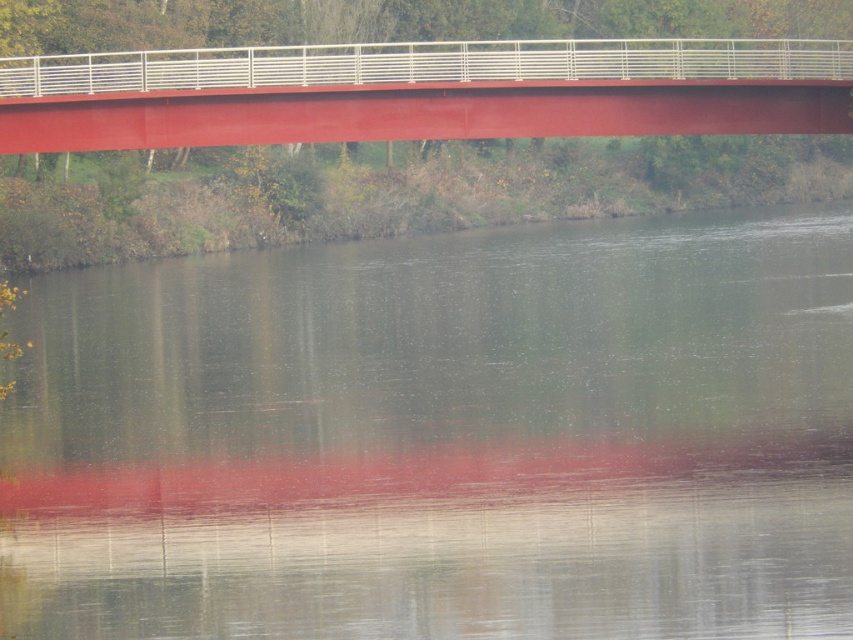
You are standing at the red bridge and looking towards the water. There are two points marked on the scene, point A at coordinates point (645,605) and point B at coordinates point (239,92). Which point do you see closer to you?

Point A at coordinates point (645,605) is closer to the camera than point B at coordinates point (239,92), so you see point A closer to you.

You are standing on the metallic red bridge at upper center and want to look down at the smooth water at center. In which direction should you look?

You should look downward to your right because the smooth water at center is to the right of the metallic red bridge at upper center.